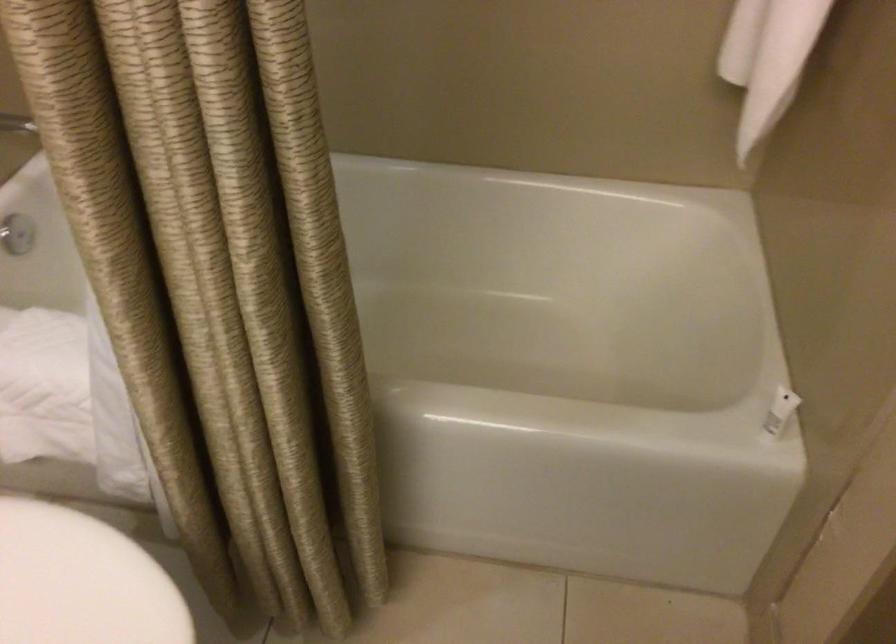
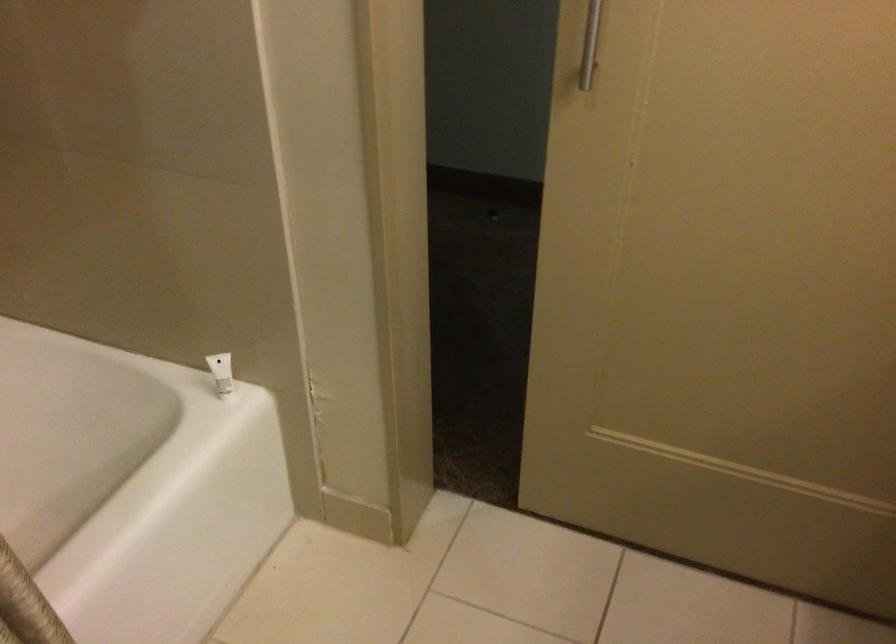
In the second image, find the point that corresponds to (x=773, y=404) in the first image.

(220, 372)